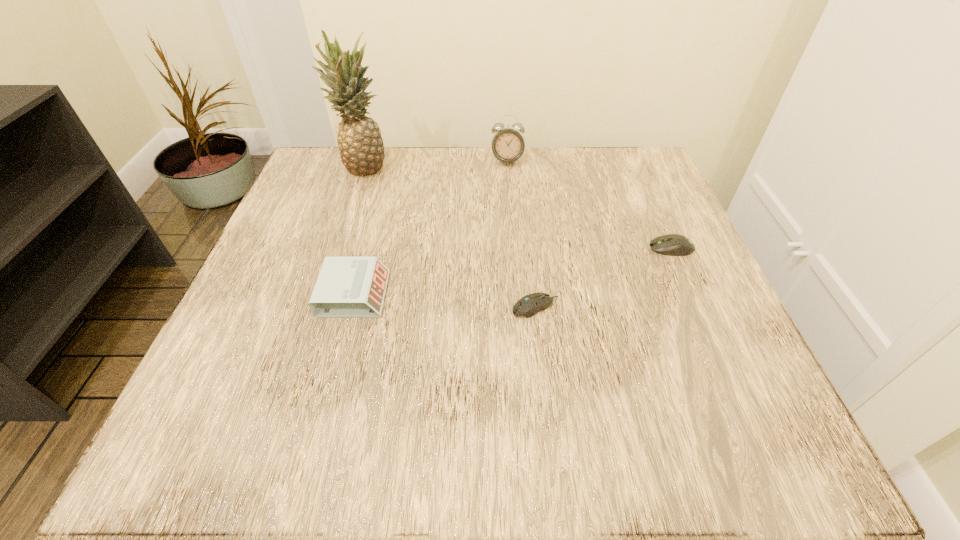
Locate an element on the screen. Image resolution: width=960 pixels, height=540 pixels. object that is at the right edge is located at coordinates (672, 244).

I want to click on object located in the far left corner section of the desktop, so click(361, 148).

At what (x,y) coordinates should I click in order to perform the action: click on blank space at the far edge of the desktop. Please return your answer as a coordinate pair (x, y). Image resolution: width=960 pixels, height=540 pixels. Looking at the image, I should click on (490, 146).

The height and width of the screenshot is (540, 960). What are the coordinates of `free region at the near edge of the desktop` in the screenshot? It's located at (397, 424).

What are the coordinates of `vacant space at the left edge` in the screenshot? It's located at (300, 325).

You are a GUI agent. You are given a task and a screenshot of the screen. Output one action in this format:
    pyautogui.click(x=<x>, y=<y>)
    Task: Click on the free space at the right edge of the desktop
    
    Given the screenshot: What is the action you would take?
    pyautogui.click(x=719, y=323)

Identify the location of vacant space at the far left corner of the desktop. The image size is (960, 540). (367, 183).

In the image, there is a desktop. Identify the location of vacant space at the far right corner. (593, 161).

This screenshot has width=960, height=540. In the image, there is a desktop. Identify the location of vacant area at the near right corner. (766, 447).

Locate an element on the screen. free space between the right alarm clock and the shorter alarm clock is located at coordinates (430, 227).